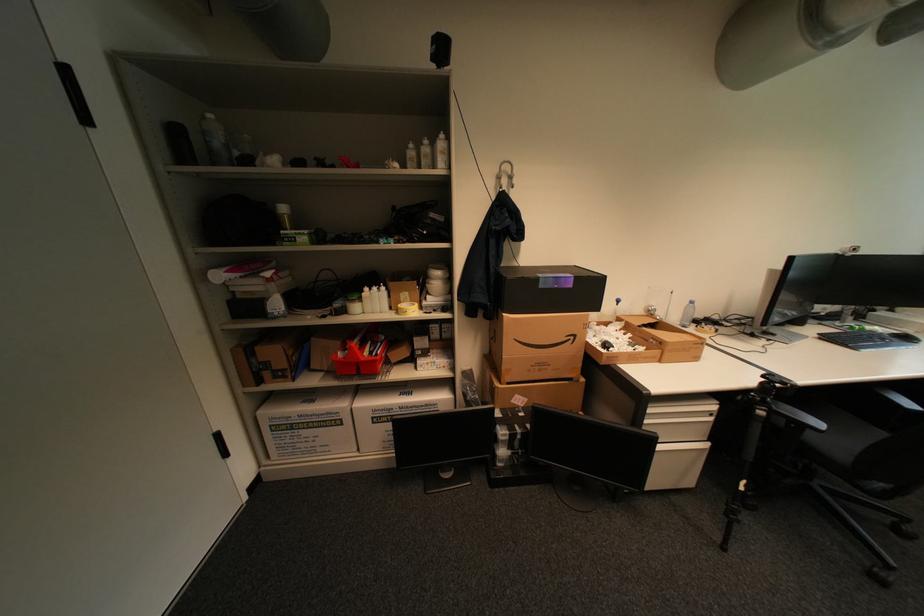
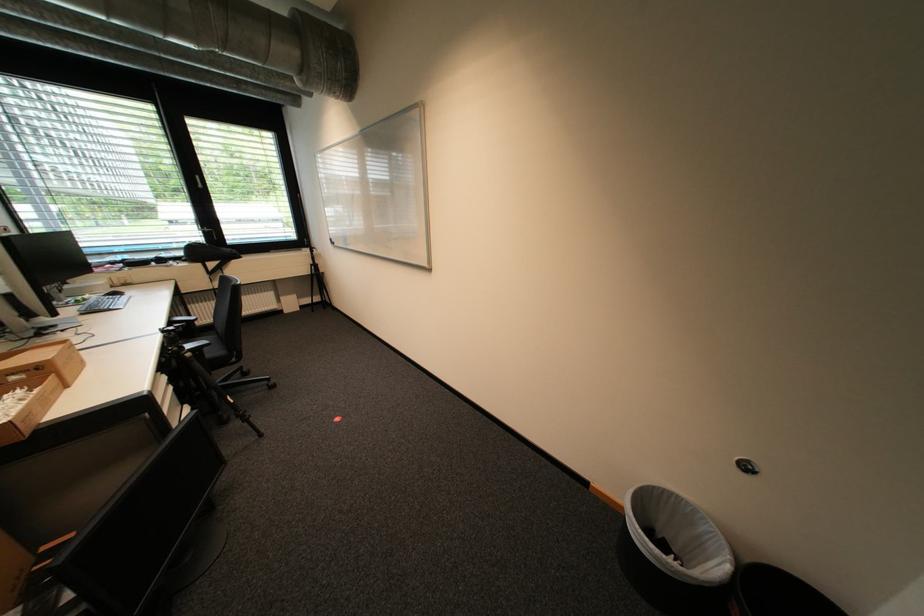
Locate, in the second image, the point that corresponds to (767,399) in the first image.

(185, 349)